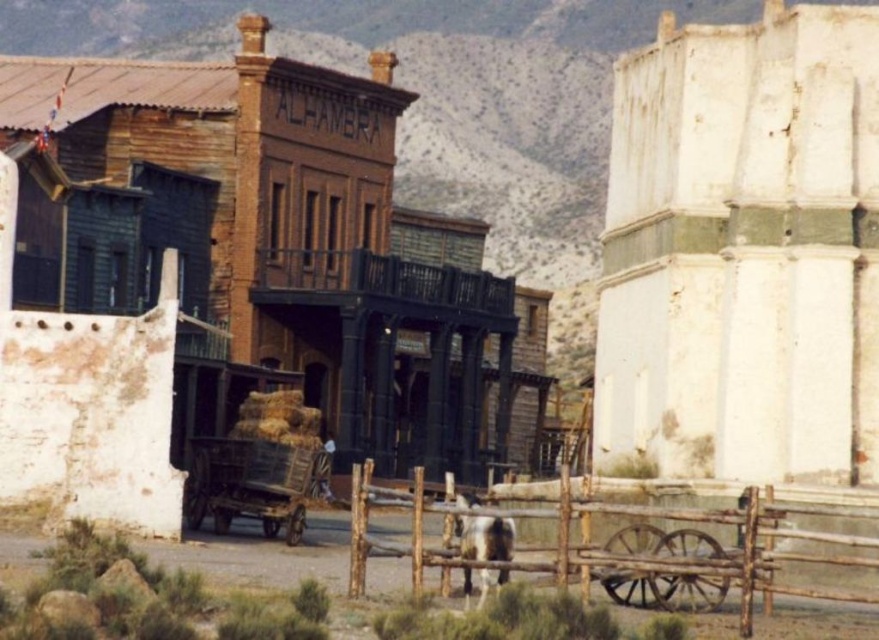
Is brown wooden fence at lower center to the right of wooden cart at center from the viewer's perspective?

Yes, brown wooden fence at lower center is to the right of wooden cart at center.

Describe the element at coordinates (609, 550) in the screenshot. I see `brown wooden fence at lower center` at that location.

This screenshot has width=879, height=640. I want to click on brown wooden fence at lower center, so click(x=609, y=550).

Is rustic wooden building at center thinner than brown wooden fence at lower center?

No.

Between rustic wooden building at center and brown wooden fence at lower center, which one has more height?

rustic wooden building at center is taller.

Locate an element on the screen. This screenshot has height=640, width=879. rustic wooden building at center is located at coordinates (274, 252).

Is rustic wooden building at center shorter than wooden cart at center?

In fact, rustic wooden building at center may be taller than wooden cart at center.

Locate an element on the screen. The height and width of the screenshot is (640, 879). rustic wooden building at center is located at coordinates (274, 252).

The image size is (879, 640). What are the coordinates of `rustic wooden building at center` in the screenshot? It's located at (274, 252).